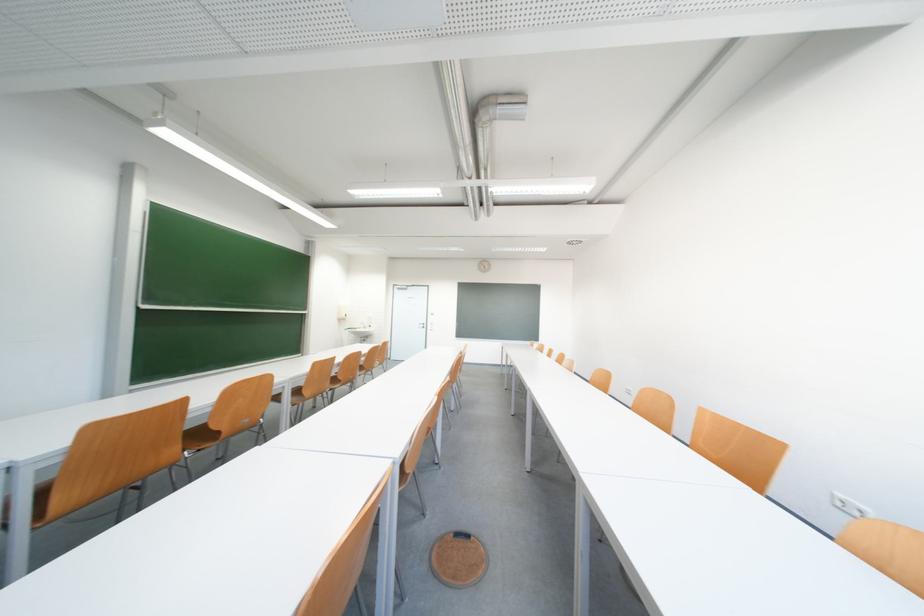
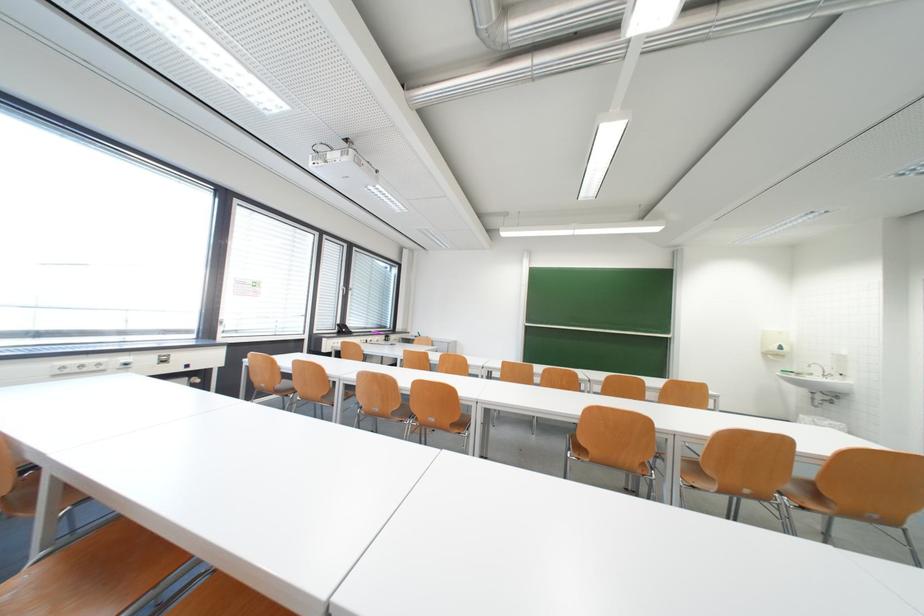
Locate, in the second image, the point that corresponds to (x=103, y=431) in the first image.

(414, 354)